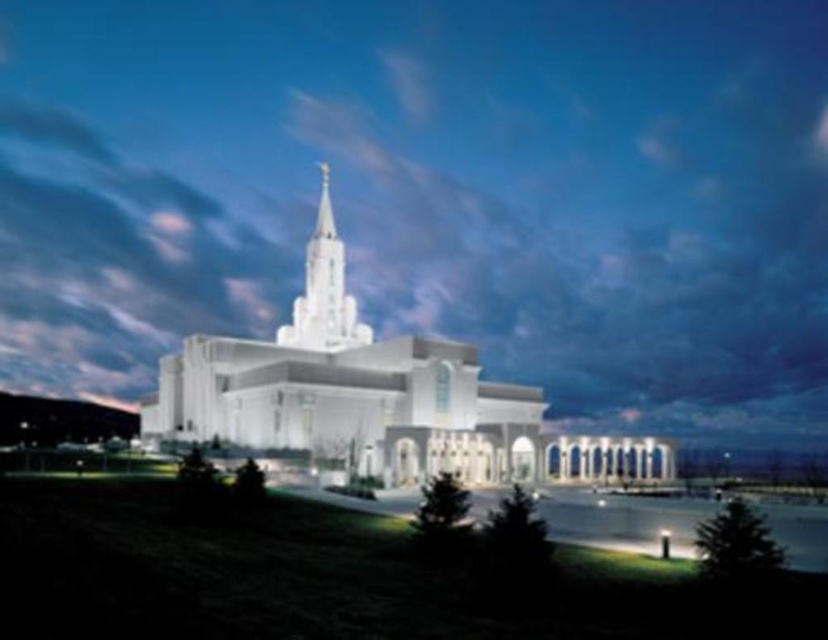
Identify the location of white smooth church at center. (374, 396).

Identify the location of white smooth church at center. (374, 396).